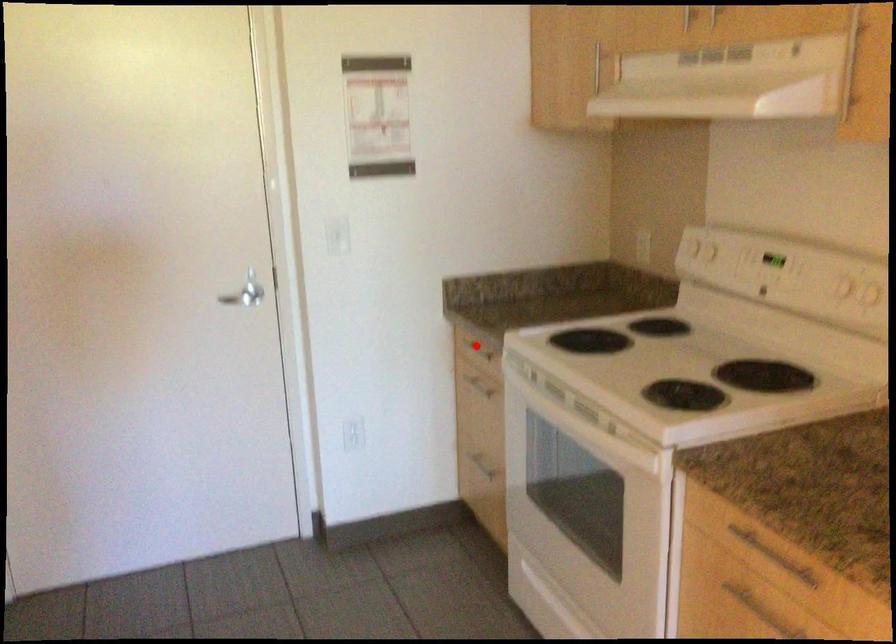
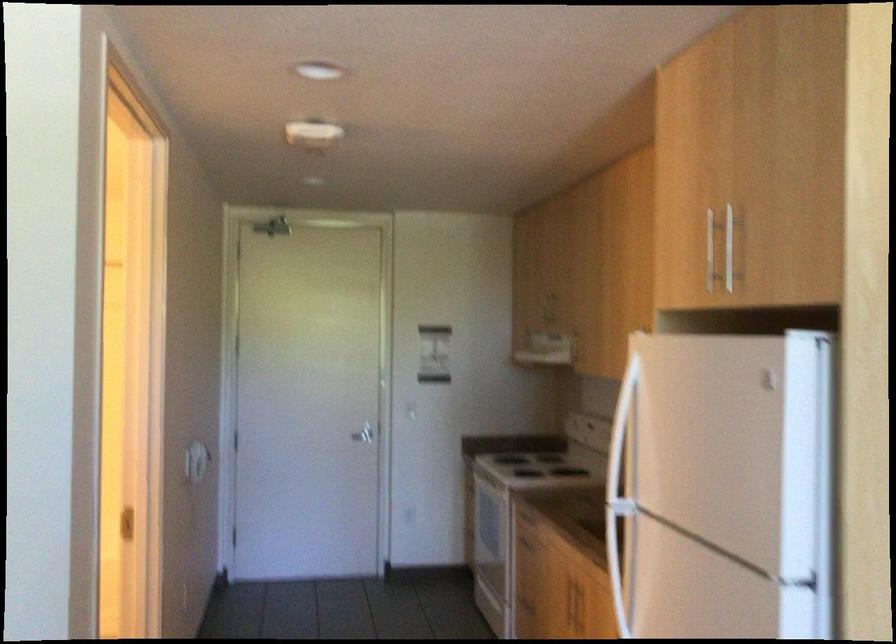
Question: I am providing you with two images of the same scene from different viewpoints. A red point is marked on the first image. At the location where the point appears in image 1, is it still visible in image 2?

Choices:
 (A) Yes
 (B) No

Answer: (B)